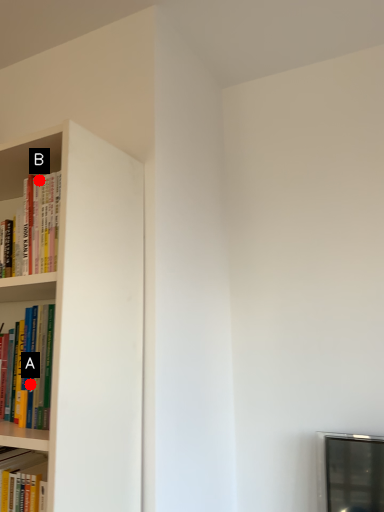
Question: Two points are circled on the image, labeled by A and B beside each circle. Which point is further to the camera?

Choices:
 (A) A is further
 (B) B is further

Answer: (B)